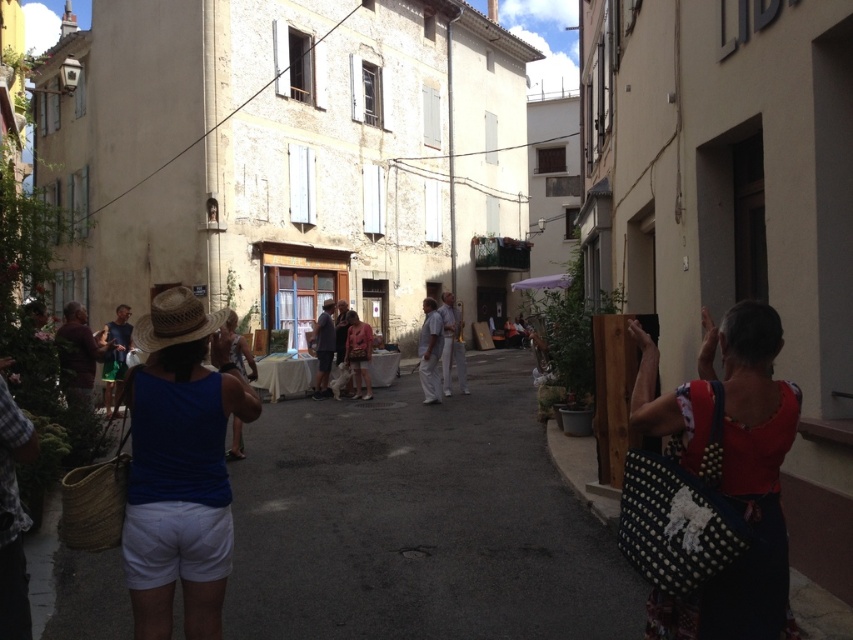
What do you see at coordinates (175, 321) in the screenshot? Image resolution: width=853 pixels, height=640 pixels. I see `strawmaterial/texturehat at center` at bounding box center [175, 321].

Which is behind, point (152, 312) or point (105, 381)?

The point (105, 381) is more distant.

Does point (143, 320) lie in front of point (99, 333)?

Yes, it is.

Locate an element on the screen. strawmaterial/texturehat at center is located at coordinates click(175, 321).

Is denim shorts at center taller than white cotton shirt at center?

In fact, denim shorts at center may be shorter than white cotton shirt at center.

Between point (212, 337) and point (431, 401), which one is positioned in front?

Point (212, 337)

Which is in front, point (215, 333) or point (424, 348)?

Point (215, 333) is in front.

Locate an element on the screen. This screenshot has width=853, height=640. denim shorts at center is located at coordinates point(231,349).

Between point (444, 360) and point (321, 358), which one is positioned in front?

Positioned in front is point (444, 360).

Between point (456, 356) and point (323, 352), which one is positioned in front?

Point (456, 356) is more forward.

Identify the location of white cotton pants at center. The width and height of the screenshot is (853, 640). (451, 344).